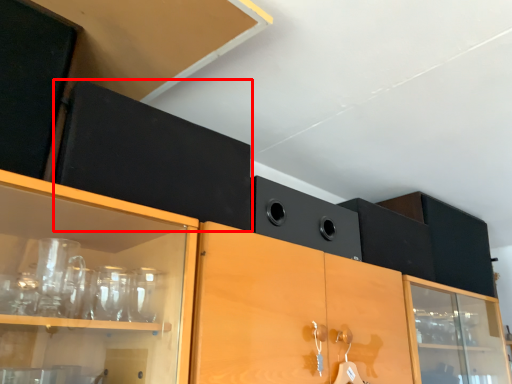
Question: In this image, where is cabinetry (annotated by the red box) located relative to speaker?

Choices:
 (A) right
 (B) left

Answer: (B)